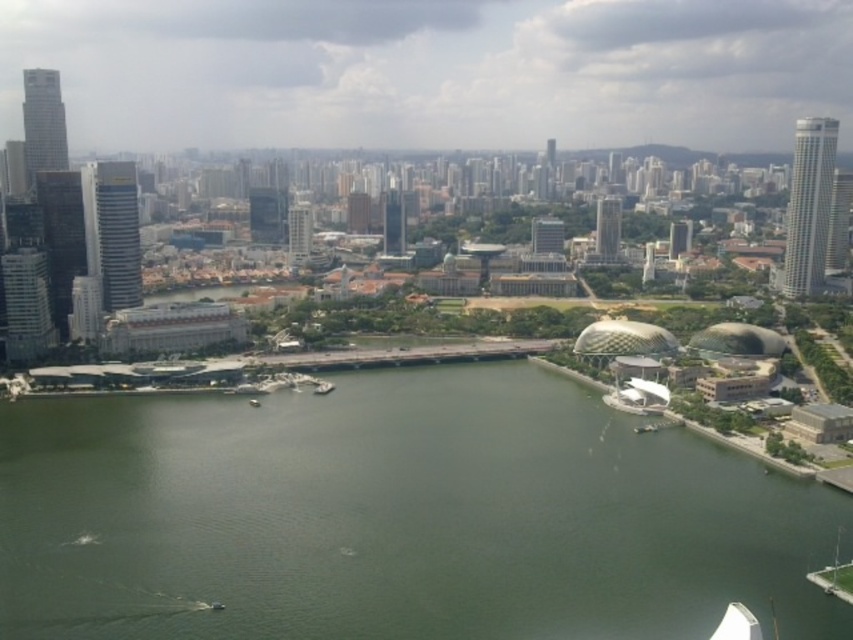
Question: Observing the image, what is the correct spatial positioning of green water at center in reference to metallic silver boat at center?

Choices:
 (A) above
 (B) below

Answer: (B)

Question: Does green water at center have a smaller size compared to metallic silver boat at center?

Choices:
 (A) no
 (B) yes

Answer: (A)

Question: Which point is farther from the camera taking this photo?

Choices:
 (A) (326, 392)
 (B) (590, 616)

Answer: (A)

Question: In this image, where is green water at center located relative to metallic silver boat at center?

Choices:
 (A) left
 (B) right

Answer: (B)

Question: Which of the following is the closest to the observer?

Choices:
 (A) (273, 627)
 (B) (317, 392)

Answer: (A)